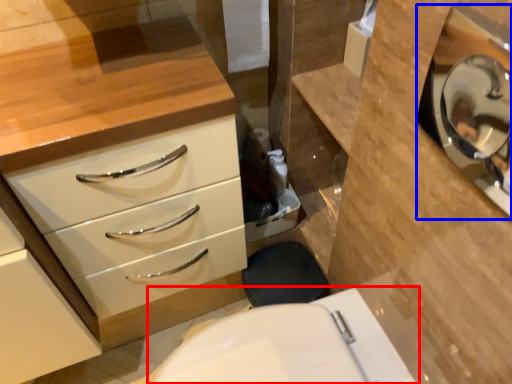
Question: Which point is closer to the camera, toilet (highlighted by a red box) or medicine cabinet (highlighted by a blue box)?

Choices:
 (A) toilet
 (B) medicine cabinet

Answer: (B)